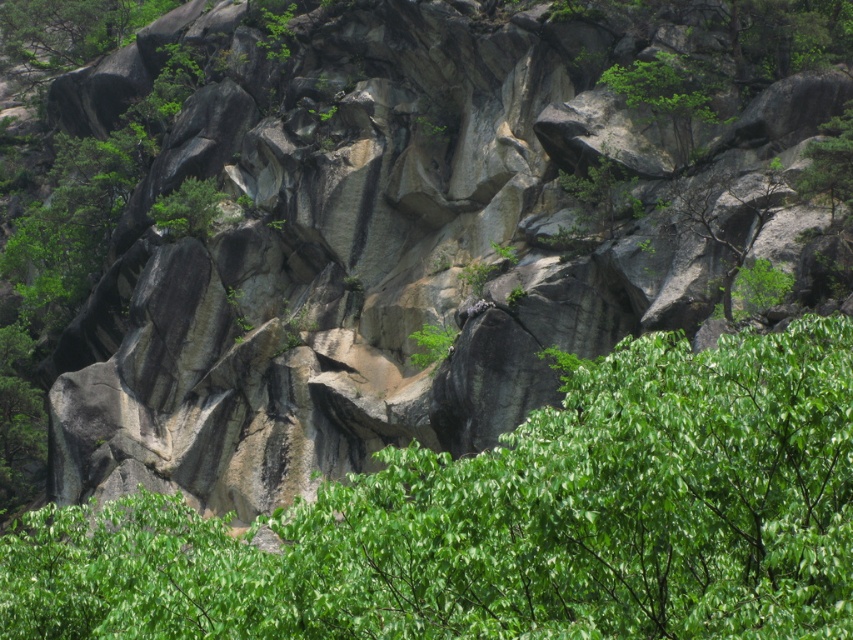
You are a hiker looking for the best spot to take a photo of the green leafy tree at upper center and the green leafy tree at upper right. Which tree should you stand closer to in order to capture both trees in the frame without zooming in?

You should stand closer to the green leafy tree at upper right because it is smaller than the green leafy tree at upper center. By positioning yourself nearer to the smaller tree, both trees will appear more balanced in size within the camera frame without requiring zoom.

You are a hiker standing at the base of the cliff and want to reach the green leafy tree at center. Which direction should you look to find it?

The green leafy tree at center is located at coordinates approximately 0.817 along the horizontal axis and 0.603 along the vertical axis. Since you are at the base, which is the bottom of the cliff, the tree is positioned to your upper center direction.

You are a photographer standing at the base of the cliff and want to capture the green leafy tree at center in your shot. If your camera has a maximum zoom range of 25 meters, can you clearly see the tree in your photo?

The green leafy tree at center and camera are 26.40 meters apart, which is beyond the camera maximum zoom range of 25 meters. Therefore, the tree may appear blurry or out of focus in the photo.